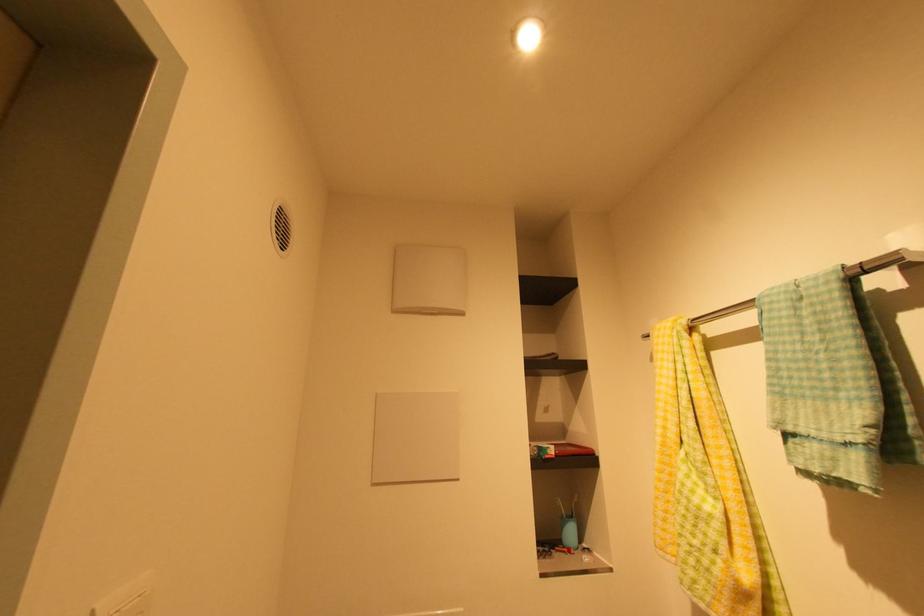
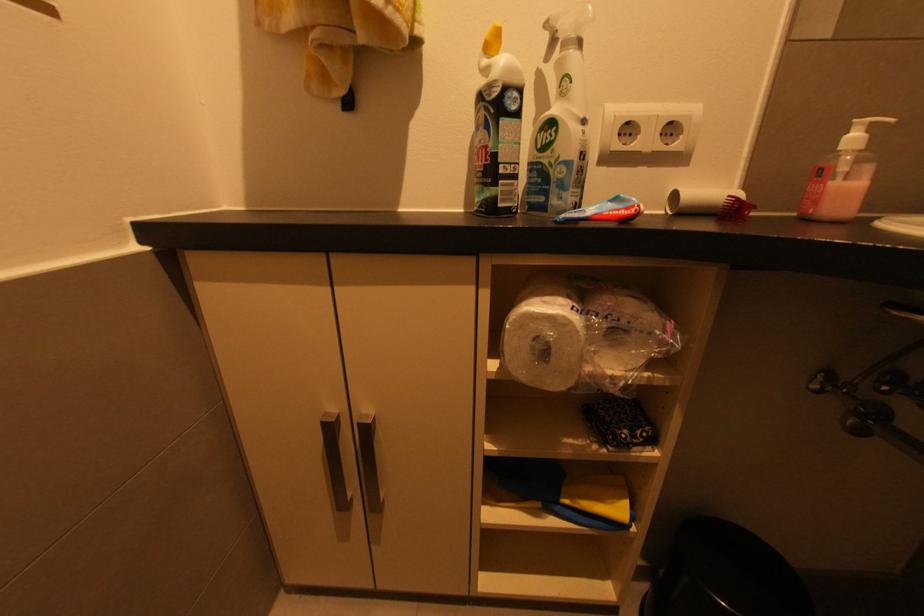
Based on the continuous images, in which direction is the camera rotating?

The camera's rotation is toward right-down.